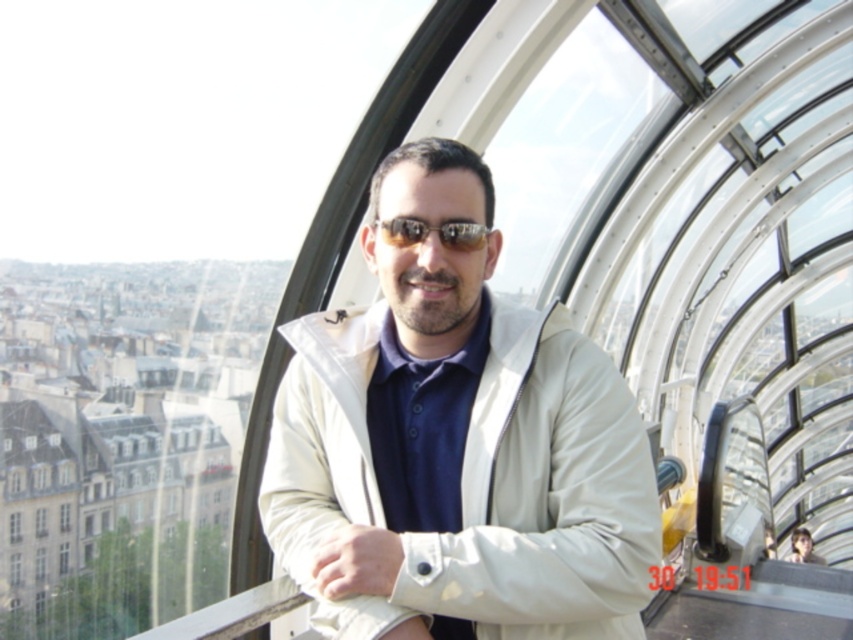
Is beige fabric jacket at center wider than matte beige jacket at center?

Yes.

Can you confirm if beige fabric jacket at center is positioned above matte beige jacket at center?

Yes.

Between point (358, 464) and point (804, 532), which one is positioned in front?

Positioned in front is point (358, 464).

Where is `beige fabric jacket at center`? beige fabric jacket at center is located at coordinates (456, 445).

Is beige fabric jacket at center above sunglasses at center?

No.

The width and height of the screenshot is (853, 640). I want to click on beige fabric jacket at center, so click(x=456, y=445).

Find the location of a particular element. The width and height of the screenshot is (853, 640). beige fabric jacket at center is located at coordinates point(456,445).

Is sunglasses at center above matte beige jacket at center?

Indeed, sunglasses at center is positioned over matte beige jacket at center.

Does sunglasses at center have a smaller size compared to matte beige jacket at center?

Yes.

Is point (476, 234) positioned in front of point (798, 532)?

Yes.

The width and height of the screenshot is (853, 640). What are the coordinates of `sunglasses at center` in the screenshot? It's located at (433, 230).